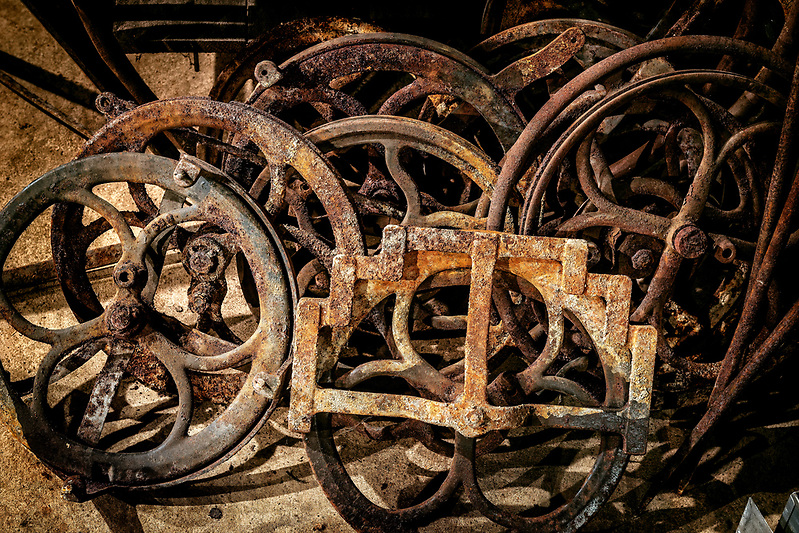
At what (x,y) coordinates should I click in order to perform the action: click on object in the corner. Please return your answer as a coordinate pair (x, y). The width and height of the screenshot is (799, 533). Looking at the image, I should click on (749, 518), (782, 521).